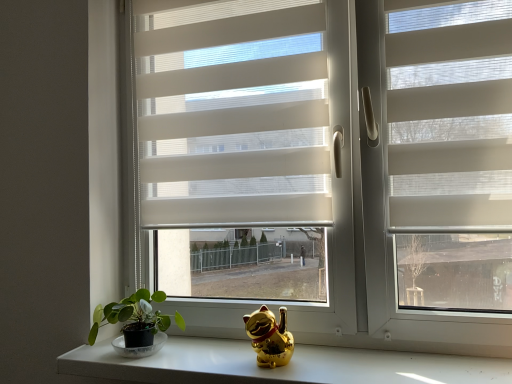
The image size is (512, 384). What are the coordinates of `vacant region to the left of gold shiny cat at center` in the screenshot? It's located at (212, 362).